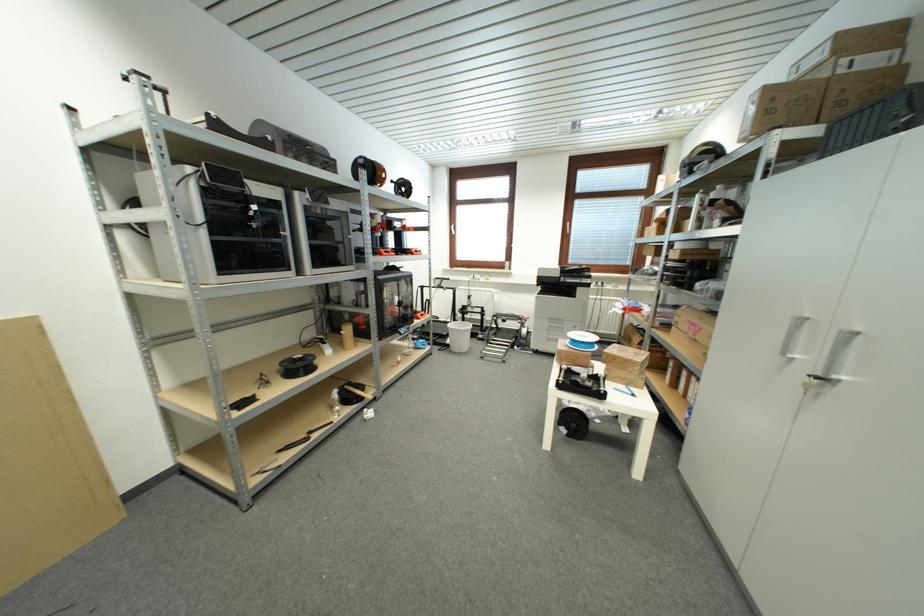
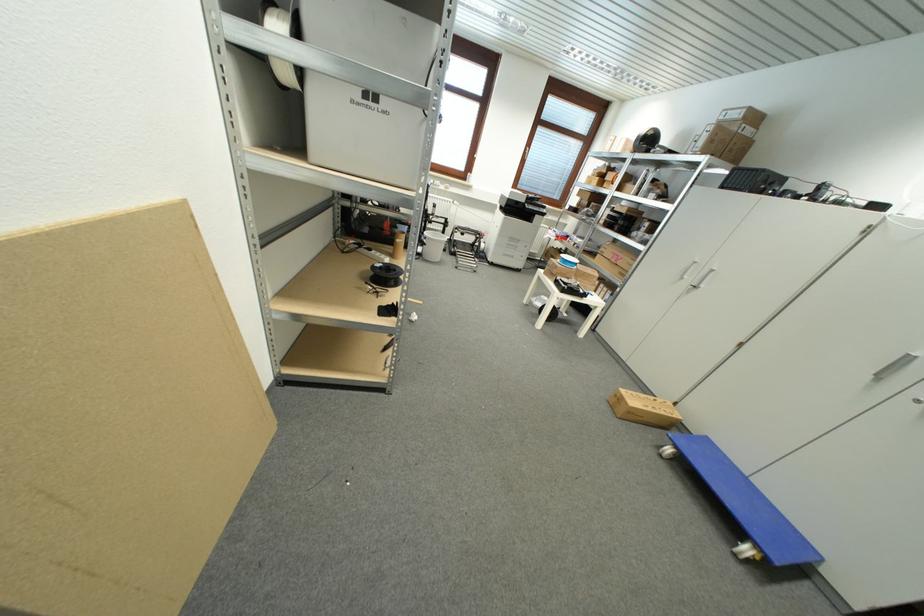
The point at (x=877, y=63) is marked in the first image. Where is the corresponding point in the second image?

(754, 134)